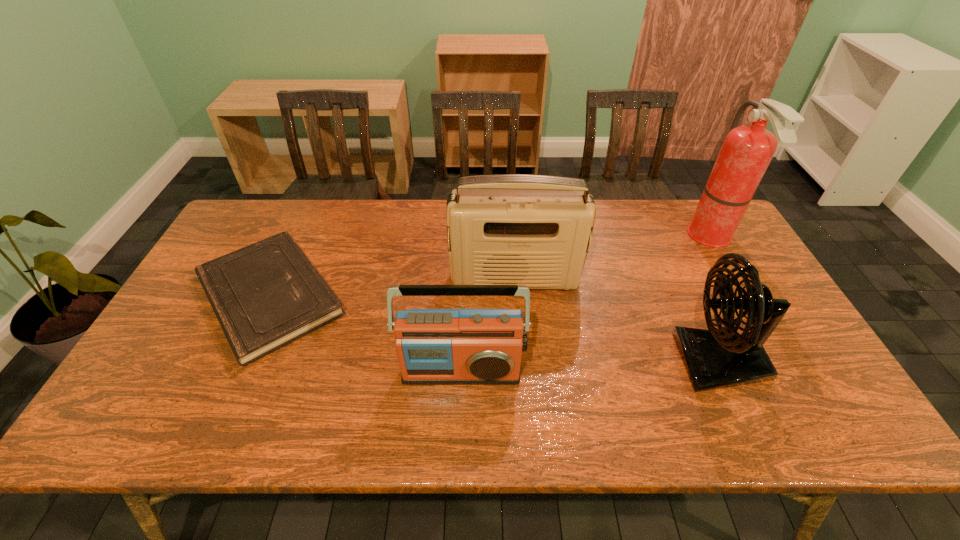
Identify the location of vacant area located on the front-facing side of the farther radio receiver. The image size is (960, 540). (525, 411).

Locate an element on the screen. Image resolution: width=960 pixels, height=540 pixels. vacant space located 0.220m in front of the fan to blow air is located at coordinates pos(587,361).

The height and width of the screenshot is (540, 960). Find the location of `blank space located in front of the fan to blow air`. blank space located in front of the fan to blow air is located at coordinates (514, 361).

Identify the location of free spot located in front of the fan to blow air. (639, 361).

Identify the location of vacant region located 0.100m on the front-facing side of the nearer radio receiver. Image resolution: width=960 pixels, height=540 pixels. (459, 429).

This screenshot has height=540, width=960. In order to click on free space located 0.050m on the back of the paperback book in this screenshot , I will do `click(300, 230)`.

At what (x,y) coordinates should I click in order to perform the action: click on fire extinguisher situated at the far edge. Please return your answer as a coordinate pair (x, y). Looking at the image, I should click on (747, 150).

The image size is (960, 540). I want to click on paperback book present at the far edge, so click(266, 295).

Identify the location of object positioned at the near edge. The image size is (960, 540). (715, 358).

Locate an element on the screen. The height and width of the screenshot is (540, 960). object present at the left edge is located at coordinates (266, 295).